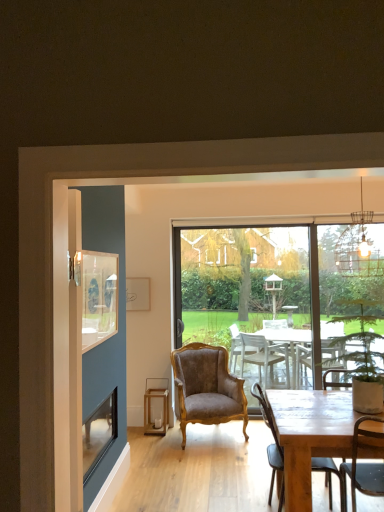
What is the approximate height of velvet brown armchair at center?

velvet brown armchair at center is 33.80 inches in height.

In order to face velvet brown armchair at center, placed as the 2th chair when sorted from right to left, should I rotate leftwards or rightwards?

You should rotate right by 1.856 degrees.

This screenshot has height=512, width=384. Describe the element at coordinates (361, 359) in the screenshot. I see `green leafy plant in pot at right` at that location.

Consider the image. What is the approximate width of wooden chair at lower right, which ranks as the second chair in back-to-front order?

wooden chair at lower right, which ranks as the second chair in back-to-front order, is 23.82 inches in width.

At what (x,y) coordinates should I click in order to perform the action: click on wooden lantern at lower center. Please return your answer as a coordinate pair (x, y). The width and height of the screenshot is (384, 512). Looking at the image, I should click on (156, 406).

What do you see at coordinates (285, 298) in the screenshot? This screenshot has height=512, width=384. I see `transparent glass window at center` at bounding box center [285, 298].

Where is `metallic wire cage at upper right`? Image resolution: width=384 pixels, height=512 pixels. metallic wire cage at upper right is located at coordinates (358, 248).

This screenshot has height=512, width=384. Describe the element at coordinates (358, 248) in the screenshot. I see `metallic wire cage at upper right` at that location.

Measure the distance between point (x=106, y=255) and camera.

Point (x=106, y=255) is 3.36 meters away from camera.

Describe the element at coordinates (97, 295) in the screenshot. This screenshot has height=512, width=384. I see `clear glass window screen at left` at that location.

What are the coordinates of `velvet brown armchair at center` in the screenshot? It's located at (335, 382).

Is velvet brown armchair at center, arranged as the second chair when viewed from the front, positioned beyond the bounds of transparent glass window at center?

velvet brown armchair at center, arranged as the second chair when viewed from the front, lies outside transparent glass window at center's area.

In terms of height, does velvet brown armchair at center, arranged as the second chair when viewed from the front, look taller or shorter compared to transparent glass window at center?

velvet brown armchair at center, arranged as the second chair when viewed from the front, is shorter than transparent glass window at center.

Which is more to the left, velvet brown armchair at center, arranged as the second chair when viewed from the front, or transparent glass window at center?

velvet brown armchair at center, arranged as the second chair when viewed from the front, is more to the left.

Is velvet brown armchair at center, marked as the first chair in a left-to-right arrangement, aimed at transparent glass window at center?

No, velvet brown armchair at center, marked as the first chair in a left-to-right arrangement, is not turned towards transparent glass window at center.

Does transparent glass window at center have a lesser width compared to metallic wire cage at upper right?

Indeed, transparent glass window at center has a lesser width compared to metallic wire cage at upper right.

Considering the relative sizes of transparent glass window at center and metallic wire cage at upper right in the image provided, is transparent glass window at center shorter than metallic wire cage at upper right?

Incorrect, the height of transparent glass window at center does not fall short of that of metallic wire cage at upper right.

Is transparent glass window at center smaller than metallic wire cage at upper right?

No, transparent glass window at center is not smaller than metallic wire cage at upper right.

Does transparent glass window at center appear on the right side of metallic wire cage at upper right?

Incorrect, transparent glass window at center is not on the right side of metallic wire cage at upper right.

Is wooden chair at lower right, marked as the 1th chair in a front-to-back arrangement, located outside velvet brown armchair at center, placed as the 2th chair when sorted from right to left?

Absolutely, wooden chair at lower right, marked as the 1th chair in a front-to-back arrangement, is external to velvet brown armchair at center, placed as the 2th chair when sorted from right to left.

From the image's perspective, is wooden chair at lower right, which is the first chair from right to left, on top of velvet brown armchair at center, which appears as the 1th chair when viewed from the back?

Yes, from the image's perspective, wooden chair at lower right, which is the first chair from right to left, is above velvet brown armchair at center, which appears as the 1th chair when viewed from the back.

How distant is wooden chair at lower right, which is the first chair from right to left, from velvet brown armchair at center, marked as the first chair in a left-to-right arrangement?

The distance of wooden chair at lower right, which is the first chair from right to left, from velvet brown armchair at center, marked as the first chair in a left-to-right arrangement, is 37.45 inches.

Does wooden chair at lower right, which is the first chair from right to left, turn towards velvet brown armchair at center, which appears as the 1th chair when viewed from the back?

No, wooden chair at lower right, which is the first chair from right to left, is not oriented towards velvet brown armchair at center, which appears as the 1th chair when viewed from the back.

Looking at this image, how far apart are green leafy plant in pot at right and wooden chair at lower right, which ranks as the second chair in back-to-front order?

They are 79.19 centimeters apart.

Which object is wider, green leafy plant in pot at right or wooden chair at lower right, which ranks as the second chair in back-to-front order?

Wider between the two is wooden chair at lower right, which ranks as the second chair in back-to-front order.

Looking at this image, from the image's perspective, between green leafy plant in pot at right and wooden chair at lower right, acting as the second chair starting from the left, who is located below?

wooden chair at lower right, acting as the second chair starting from the left, from the image's perspective.

Between point (371, 392) and point (282, 462), which one is positioned in front?

The point (282, 462) is more forward.

Is wooden chair at lower right, acting as the second chair starting from the left, directly adjacent to green leafy plant in pot at right?

No, wooden chair at lower right, acting as the second chair starting from the left, is not beside green leafy plant in pot at right.

Can you confirm if wooden chair at lower right, marked as the 1th chair in a front-to-back arrangement, is shorter than green leafy plant in pot at right?

In fact, wooden chair at lower right, marked as the 1th chair in a front-to-back arrangement, may be taller than green leafy plant in pot at right.

Based on the photo, is wooden chair at lower right, acting as the second chair starting from the left, bigger or smaller than green leafy plant in pot at right?

Considering their sizes, wooden chair at lower right, acting as the second chair starting from the left, takes up less space than green leafy plant in pot at right.

Would you say metallic wire cage at upper right is a long distance from green leafy plant in pot at right?

Indeed, metallic wire cage at upper right is not near green leafy plant in pot at right.

Is metallic wire cage at upper right outside of green leafy plant in pot at right?

Yes, metallic wire cage at upper right is located beyond the bounds of green leafy plant in pot at right.

Considering the sizes of objects metallic wire cage at upper right and green leafy plant in pot at right in the image provided, who is taller, metallic wire cage at upper right or green leafy plant in pot at right?

Standing taller between the two is metallic wire cage at upper right.

Considering the positions of point (341, 234) and point (350, 352), is point (341, 234) closer or farther from the camera than point (350, 352)?

Point (341, 234) appears to be farther away from the viewer than point (350, 352).

Does metallic wire cage at upper right have a larger size compared to wooden lantern at lower center?

Correct, metallic wire cage at upper right is larger in size than wooden lantern at lower center.

Between metallic wire cage at upper right and wooden lantern at lower center, which one appears on the left side from the viewer's perspective?

wooden lantern at lower center.

Is metallic wire cage at upper right behind wooden lantern at lower center?

No, metallic wire cage at upper right is closer to the viewer.

Image resolution: width=384 pixels, height=512 pixels. What are the coordinates of `window that appears above the velvet brown armchair at center, marked as the first chair in a left-to-right arrangement (from the image's perspective)` in the screenshot? It's located at pos(285,298).

You are a GUI agent. You are given a task and a screenshot of the screen. Output one action in this format:
    pyautogui.click(x=<x>, y=<y>)
    Task: Click on the lamp above the transparent glass window at center (from a real-world perspective)
    The height and width of the screenshot is (512, 384).
    Given the screenshot: What is the action you would take?
    pyautogui.click(x=358, y=248)

From the image, which object appears to be farther from velvet brown armchair at center, green leafy plant in pot at right or metallic wire cage at upper right?

metallic wire cage at upper right is further to velvet brown armchair at center.

Which object lies further to the anchor point velvet brown armchair at center, transparent glass window at center or metallic wire cage at upper right?

metallic wire cage at upper right.

Considering their positions, is transparent glass window at center positioned further to green leafy plant in pot at right than wooden lantern at lower center?

Among the two, transparent glass window at center is located further to green leafy plant in pot at right.

Based on their spatial positions, is wooden lantern at lower center or transparent glass window at center further from clear glass window screen at left?

transparent glass window at center.

Based on their spatial positions, is transparent glass window at center or velvet brown armchair at center, marked as the first chair in a left-to-right arrangement, closer to clear glass window screen at left?

velvet brown armchair at center, marked as the first chair in a left-to-right arrangement, is closer to clear glass window screen at left.

Estimate the real-world distances between objects in this image. Which object is further from metallic wire cage at upper right, velvet brown armchair at center, marked as the first chair in a left-to-right arrangement, or transparent glass window at center?

The object further to metallic wire cage at upper right is velvet brown armchair at center, marked as the first chair in a left-to-right arrangement.

Estimate the real-world distances between objects in this image. Which object is closer to clear glass window screen at left, wooden chair at lower right, which ranks as the second chair in back-to-front order, or wooden lantern at lower center?

wooden chair at lower right, which ranks as the second chair in back-to-front order.

Estimate the real-world distances between objects in this image. Which object is further from velvet brown armchair at center, placed as the 2th chair when sorted from right to left, metallic wire cage at upper right or velvet brown armchair at center?

Among the two, metallic wire cage at upper right is located further to velvet brown armchair at center, placed as the 2th chair when sorted from right to left.

Find the location of a particular element. The image size is (384, 512). lamp located between velvet brown armchair at center and transparent glass window at center in the depth direction is located at coordinates (358, 248).

At what (x,y) coordinates should I click in order to perform the action: click on lantern between velvet brown armchair at center and transparent glass window at center along the z-axis. Please return your answer as a coordinate pair (x, y). This screenshot has height=512, width=384. Looking at the image, I should click on (156, 406).

The width and height of the screenshot is (384, 512). I want to click on lamp between clear glass window screen at left and wooden lantern at lower center along the z-axis, so [x=358, y=248].

Locate an element on the screen. Image resolution: width=384 pixels, height=512 pixels. chair between metallic wire cage at upper right and velvet brown armchair at center, marked as the first chair in a left-to-right arrangement, from top to bottom is located at coordinates (271, 445).